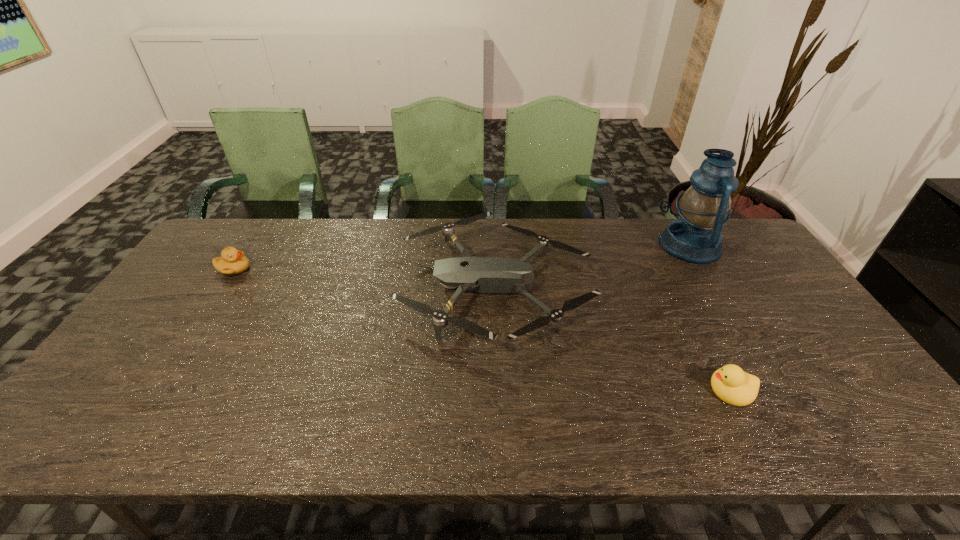
Locate an element on the screen. The width and height of the screenshot is (960, 540). object at the right edge is located at coordinates (695, 237).

The height and width of the screenshot is (540, 960). I want to click on object located at the far left corner, so click(232, 261).

Identify the location of object located in the far right corner section of the desktop. (695, 237).

Identify the location of free spot at the far edge of the desktop. (380, 228).

In order to click on free space at the near edge of the desktop in this screenshot , I will do `click(542, 446)`.

At what (x,y) coordinates should I click in order to perform the action: click on vacant space at the left edge of the desktop. Please return your answer as a coordinate pair (x, y). Image resolution: width=960 pixels, height=540 pixels. Looking at the image, I should click on [x=151, y=323].

This screenshot has height=540, width=960. I want to click on vacant space at the right edge, so click(x=776, y=343).

Image resolution: width=960 pixels, height=540 pixels. I want to click on blank area at the far right corner, so click(x=739, y=235).

Identify the location of vacant space at the near right corner of the desktop. This screenshot has width=960, height=540. (836, 415).

This screenshot has width=960, height=540. Find the location of `empty space that is in between the lantern and the third object from right to left`. empty space that is in between the lantern and the third object from right to left is located at coordinates (593, 266).